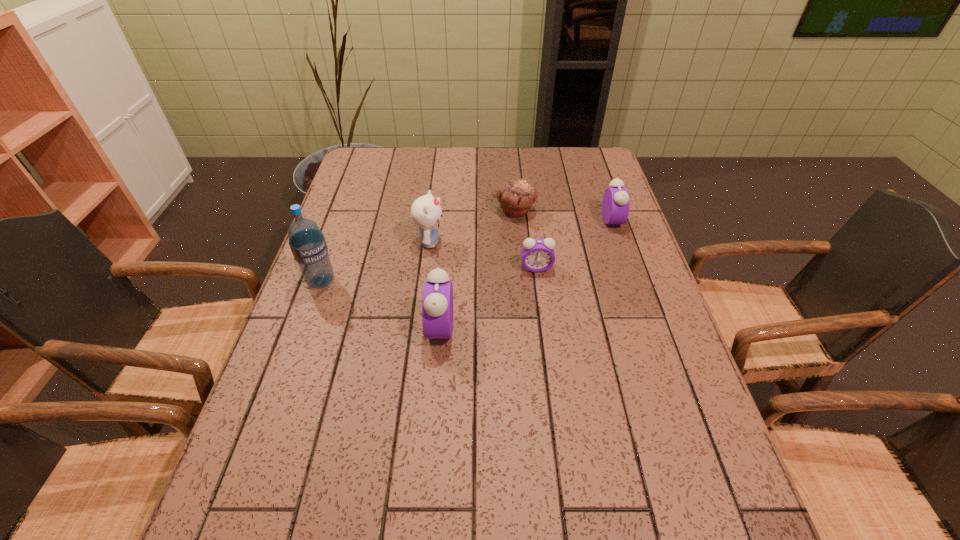
You are a GUI agent. You are given a task and a screenshot of the screen. Output one action in this format:
    pyautogui.click(x=<x>, y=<y>)
    Task: Click on the free point between the kitten and the tallest object
    The width and height of the screenshot is (960, 540).
    Given the screenshot: What is the action you would take?
    pyautogui.click(x=375, y=261)

At what (x,y) coordinates should I click in order to perform the action: click on vacant region between the water bottle and the kitten. Please return your answer as a coordinate pair (x, y). Image resolution: width=960 pixels, height=540 pixels. Looking at the image, I should click on (375, 261).

I want to click on object that is the second nearest to the rightmost object, so click(x=537, y=255).

Where is `object that is the closest one to the rightmost object`? This screenshot has width=960, height=540. object that is the closest one to the rightmost object is located at coordinates (516, 196).

The width and height of the screenshot is (960, 540). Find the location of `alarm clock that is the second nearest to the second shortest alarm clock`. alarm clock that is the second nearest to the second shortest alarm clock is located at coordinates (437, 304).

You are a GUI agent. You are given a task and a screenshot of the screen. Output one action in this format:
    pyautogui.click(x=<x>, y=<y>)
    Task: Click on the alarm clock that stands as the second closest to the leftmost object
    The height and width of the screenshot is (540, 960).
    Given the screenshot: What is the action you would take?
    pyautogui.click(x=537, y=255)

The height and width of the screenshot is (540, 960). What are the coordinates of `free point that satisfies the following two spatial constraints: 1. on the face of the second nearest alarm clock; 2. on the face of the leftmost alarm clock` in the screenshot? It's located at (544, 328).

Image resolution: width=960 pixels, height=540 pixels. I want to click on vacant space that satisfies the following two spatial constraints: 1. on the face of the second nearest alarm clock; 2. on the face of the tallest alarm clock, so click(544, 328).